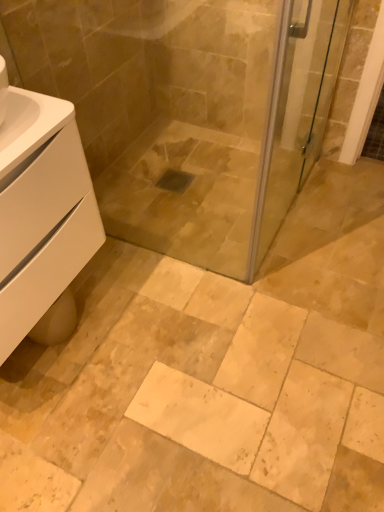
Question: Does transparent glass screen door at upper right turn towards white matte cabinet at lower left?

Choices:
 (A) yes
 (B) no

Answer: (B)

Question: Can you confirm if transparent glass screen door at upper right is taller than white matte cabinet at lower left?

Choices:
 (A) yes
 (B) no

Answer: (A)

Question: From the image's perspective, is transparent glass screen door at upper right located above white matte cabinet at lower left?

Choices:
 (A) no
 (B) yes

Answer: (B)

Question: From a real-world perspective, does transparent glass screen door at upper right sit lower than white matte cabinet at lower left?

Choices:
 (A) no
 (B) yes

Answer: (B)

Question: Does transparent glass screen door at upper right come behind white matte cabinet at lower left?

Choices:
 (A) no
 (B) yes

Answer: (B)

Question: Does transparent glass screen door at upper right appear on the left side of white matte cabinet at lower left?

Choices:
 (A) no
 (B) yes

Answer: (A)

Question: Is white matte cabinet at lower left looking in the opposite direction of transparent glass screen door at upper right?

Choices:
 (A) no
 (B) yes

Answer: (A)

Question: Is white matte cabinet at lower left surrounding transparent glass screen door at upper right?

Choices:
 (A) yes
 (B) no

Answer: (B)

Question: Is white matte cabinet at lower left aimed at transparent glass screen door at upper right?

Choices:
 (A) no
 (B) yes

Answer: (A)

Question: Does white matte cabinet at lower left have a greater width compared to transparent glass screen door at upper right?

Choices:
 (A) no
 (B) yes

Answer: (B)

Question: Can you confirm if white matte cabinet at lower left is taller than transparent glass screen door at upper right?

Choices:
 (A) no
 (B) yes

Answer: (A)

Question: From the image's perspective, is white matte cabinet at lower left located beneath transparent glass screen door at upper right?

Choices:
 (A) yes
 (B) no

Answer: (A)

Question: Looking at the image, does white matte cabinet at lower left seem bigger or smaller compared to transparent glass screen door at upper right?

Choices:
 (A) small
 (B) big

Answer: (B)